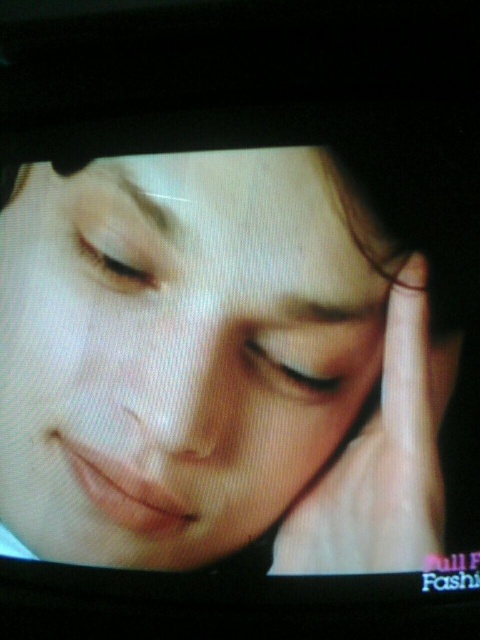
Question: Which object is the closest to the matte white eye at center?

Choices:
 (A) smooth skin face at center
 (B) matte skin eye at center
 (C) smooth skin finger at center

Answer: (C)

Question: Which of these objects is positioned closest to the matte white eye at center?

Choices:
 (A) matte skin eye at center
 (B) smooth skin face at center

Answer: (B)

Question: Which point appears closest to the camera in this image?

Choices:
 (A) (330, 385)
 (B) (109, 230)

Answer: (A)

Question: Is the position of matte skin eye at center more distant than that of matte white eye at center?

Choices:
 (A) no
 (B) yes

Answer: (B)

Question: Observing the image, what is the correct spatial positioning of smooth skin face at center in reference to matte white eye at center?

Choices:
 (A) right
 (B) left

Answer: (B)

Question: From the image, what is the correct spatial relationship of smooth skin face at center in relation to smooth skin finger at center?

Choices:
 (A) below
 (B) above

Answer: (B)